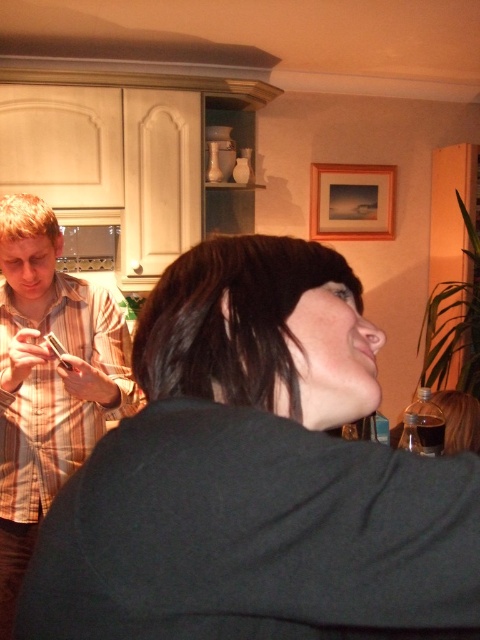
You are organizing a clothing donation drive and need to determine which item is shorter between the dark gray sweater at center and the plaid shirt at left. Based on the scene, which one should be labeled as shorter?

The dark gray sweater at center has a lesser height compared to the plaid shirt at left, so the dark gray sweater at center should be labeled as shorter.